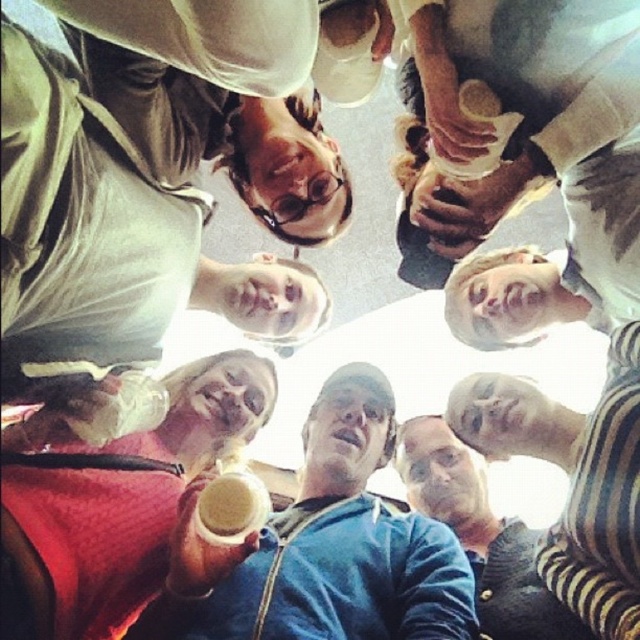
Question: Which object is farther from the camera taking this photo?

Choices:
 (A) matte white hoodie at upper left
 (B) blue denim jacket at center

Answer: (B)

Question: Among these points, which one is farthest from the camera?

Choices:
 (A) (349, 522)
 (B) (449, 451)
 (C) (160, 486)

Answer: (B)

Question: Does blue fleece jacket at center appear over blue denim jacket at center?

Choices:
 (A) yes
 (B) no

Answer: (A)

Question: Is matte white hoodie at upper left thinner than blue denim jacket at center?

Choices:
 (A) yes
 (B) no

Answer: (B)

Question: Estimate the real-world distances between objects in this image. Which object is closer to the blue fleece jacket at center?

Choices:
 (A) matte plastic cup at lower left
 (B) matte white hoodie at upper left

Answer: (A)

Question: Is the position of matte white hoodie at upper left less distant than that of blue fleece jacket at center?

Choices:
 (A) no
 (B) yes

Answer: (B)